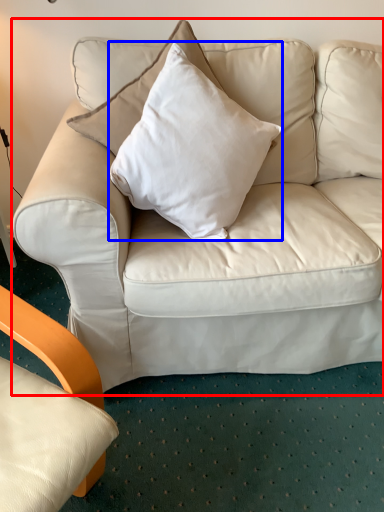
Question: Among these objects, which one is farthest to the camera, studio couch (highlighted by a red box) or pillow (highlighted by a blue box)?

Choices:
 (A) studio couch
 (B) pillow

Answer: (A)